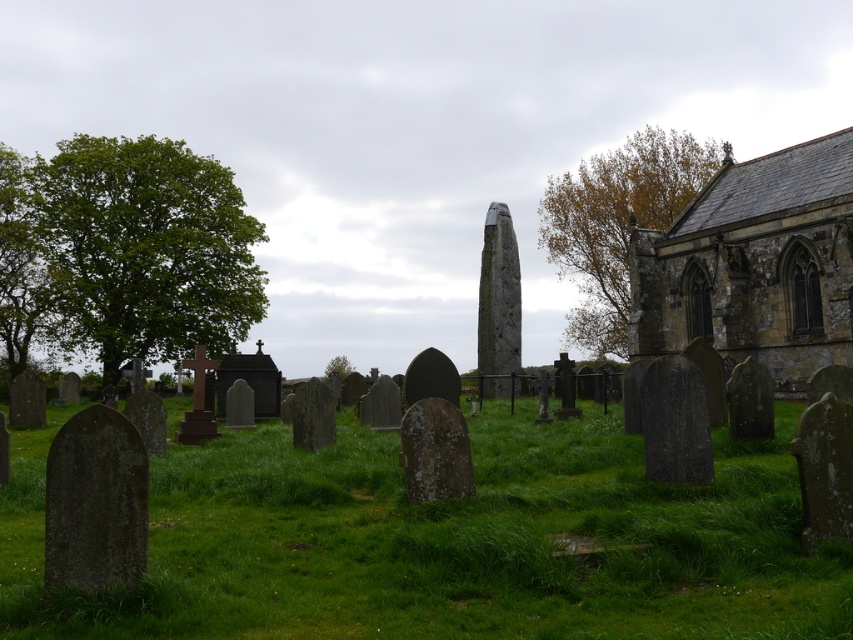
Question: Which object is closer to the camera taking this photo?

Choices:
 (A) green leafy tree at left
 (B) brown stone church at upper right
 (C) green leafy tree at center
 (D) green grassy at center

Answer: (D)

Question: Can you confirm if green leafy tree at left is smaller than green leafy tree at center?

Choices:
 (A) yes
 (B) no

Answer: (B)

Question: Does brown stone church at upper right have a smaller size compared to green leafy tree at center?

Choices:
 (A) no
 (B) yes

Answer: (A)

Question: Does brown stone church at upper right lie behind green leafy tree at center?

Choices:
 (A) no
 (B) yes

Answer: (A)

Question: Which of the following is the farthest from the observer?

Choices:
 (A) brown textured tree at upper center
 (B) brown stone church at upper right
 (C) green leafy tree at center
 (D) green leafy tree at left

Answer: (C)

Question: Considering the real-world distances, which object is farthest from the brown textured tree at upper center?

Choices:
 (A) green leafy tree at left
 (B) green grassy at center

Answer: (B)